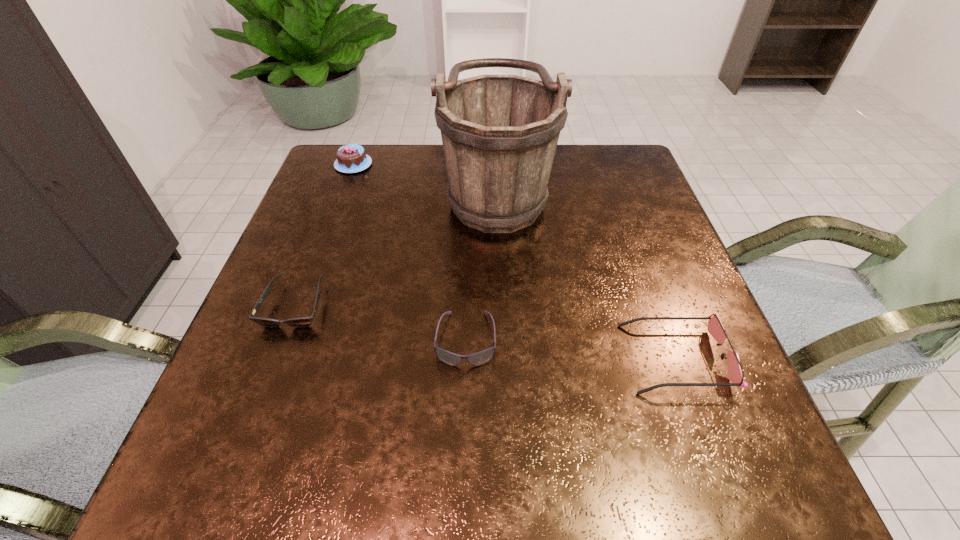
Identify the location of free space that satisfies the following two spatial constraints: 1. on the handle side of the bucket; 2. on the lenses of the second sunglasses from right to left. (503, 339).